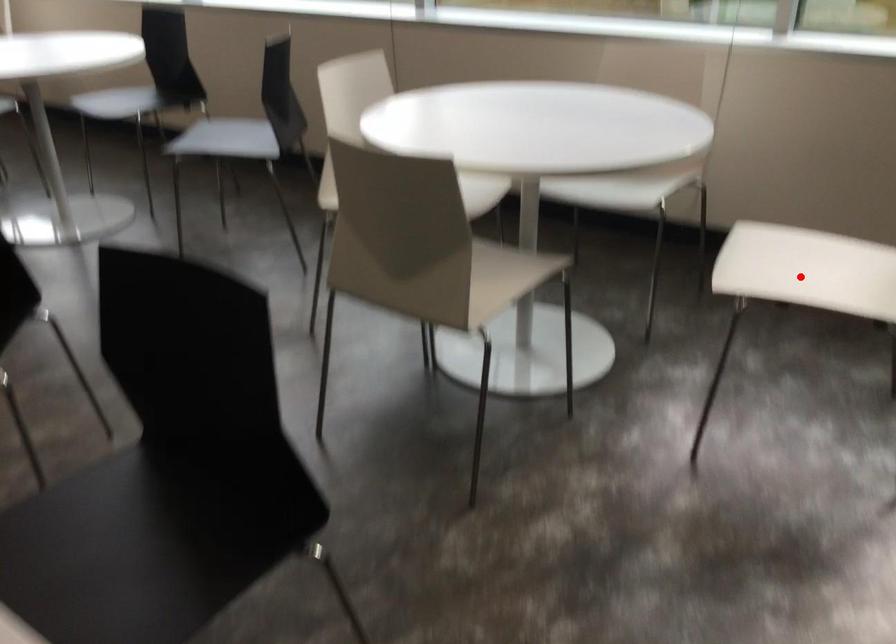
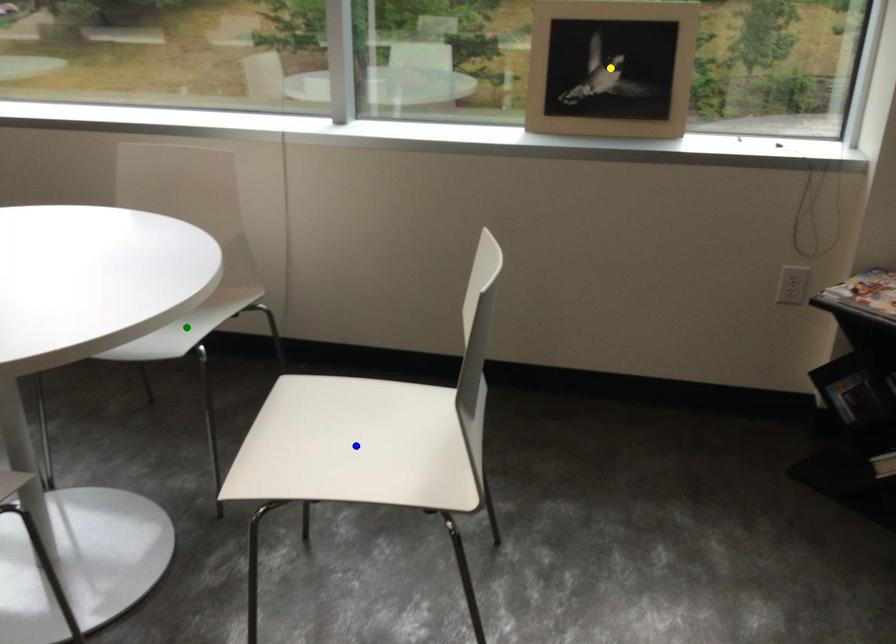
Question: I am providing you with two images of the same scene from different viewpoints. A red point is marked on the first image. You are given multiple points on the second image. In image 2, which mark is for the same physical point as the one in image 1?

Choices:
 (A) blue point
 (B) green point
 (C) yellow point

Answer: (A)